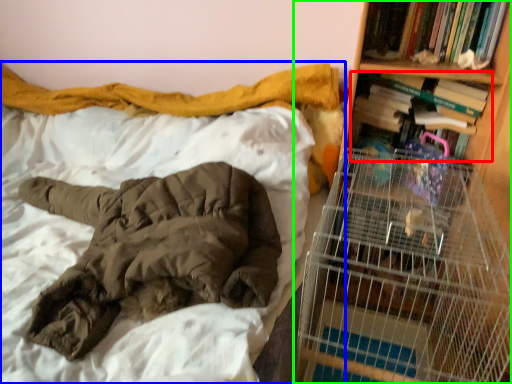
Question: Based on their relative distances, which object is farther from book (highlighted by a red box)? Choose from bed (highlighted by a blue box) and bookcase (highlighted by a green box).

Choices:
 (A) bed
 (B) bookcase

Answer: (A)